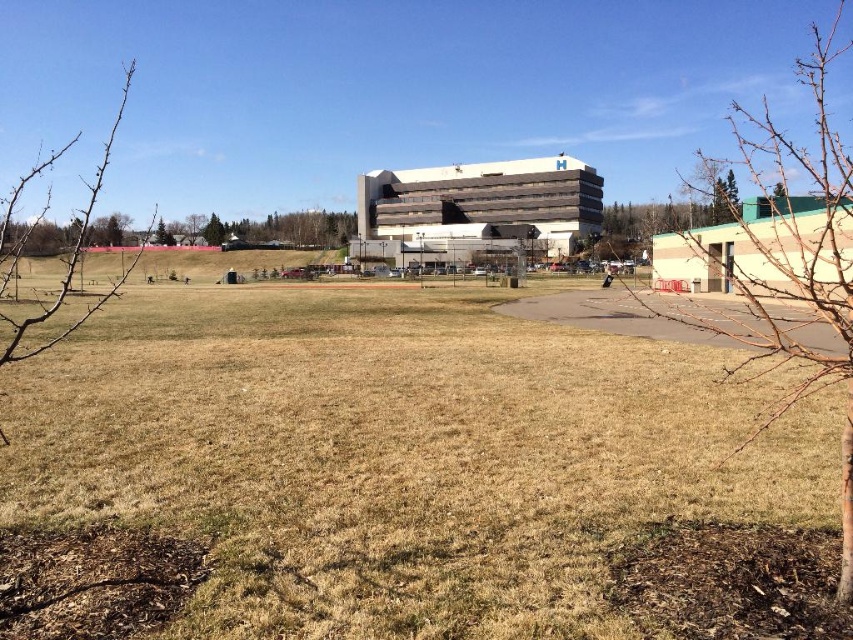
You are standing at the entrance of the hospital building and want to walk to the point marked on the map at coordinates point (383, 461). Based on the scene description, what type of terrain will you encounter when you arrive at that point?

The point (383, 461) is on brown dry grass at center, so you will encounter brown dry grass terrain there.

You are standing at the camera position and want to pick up the bare branches at lower right. Can you reach them without moving your feet?

The distance between the bare branches at lower right and the camera is 9.65 feet, so you cannot reach them without moving your feet since the distance is too far.

You are standing at the entrance of the building and want to walk to the point marked as point (840, 289). However, there is an obstacle at point (688, 424). Will you be able to see the obstacle while walking towards your destination?

Since point (688, 424) is behind point (840, 289), the obstacle at point (688, 424) will be hidden behind the destination point (840, 289). Therefore, you won not be able to see the obstacle while walking towards your destination.